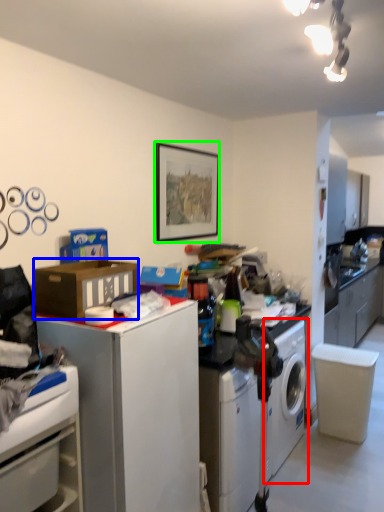
Question: Based on their relative distances, which object is nearer to washing machine (highlighted by a red box)? Choose from cardboard box (highlighted by a blue box) and picture frame (highlighted by a green box).

Choices:
 (A) cardboard box
 (B) picture frame

Answer: (B)